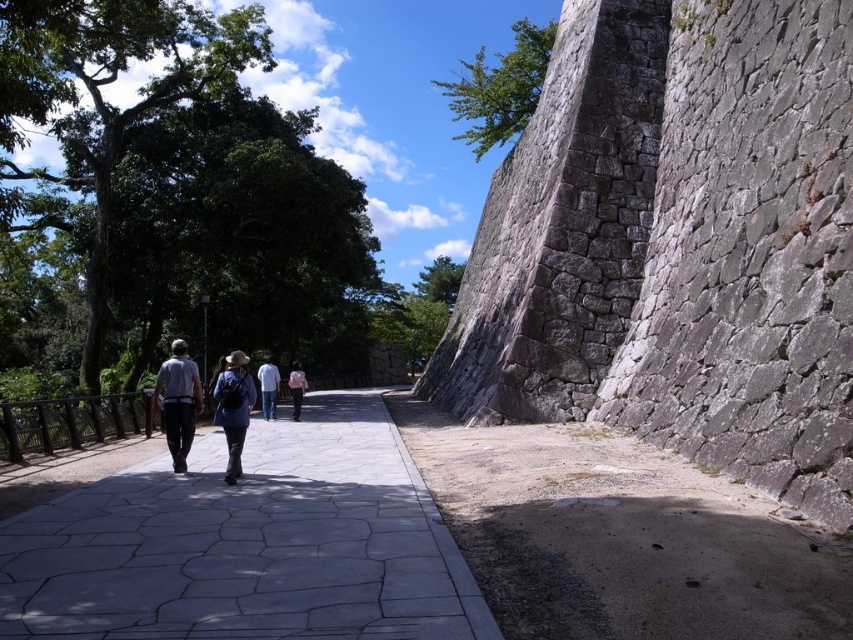
You are a photographer trying to capture a clear shot of the pink fabric shirt at center without the blue fabric backpack at center blocking it. How can you adjust your position to achieve this?

The blue fabric backpack at center is positioned over the pink fabric shirt at center, so to avoid the backpack blocking the shirt, you should move your camera position lower or shift to the side so that the backpack is no longer in front of the shirt.

You are a photographer standing at the end of the pathway. You want to take a photo that includes both the denim jacket at center and the pink fabric shirt at center. What is the minimum distance you need to move forward to ensure both subjects are in frame?

The denim jacket at center and pink fabric shirt at center are 21.34 meters apart from each other. To capture both in the frame, you would need to move forward until the distance between them fits within your camera lens field of view. However, without specific lens details, the minimum distance can be estimated by ensuring the subjects are within the camera sensor and focal length capabilities. A rough estimate might require moving to a point where the 21.34 meters span is within the camera sensor coverage

You are a photographer standing at the starting point of the pathway. You want to capture both the blue fabric backpack at center and the pink fabric shirt at center in the same frame. Given that your camera has a maximum focal length that allows capturing objects up to 20 meters apart, will you be able to include both in your shot?

The blue fabric backpack at center and pink fabric shirt at center are 20.38 meters apart from each other. Since the maximum distance your camera can capture is 20 meters, which is less than 20.38 meters, you will not be able to include both in the same frame.